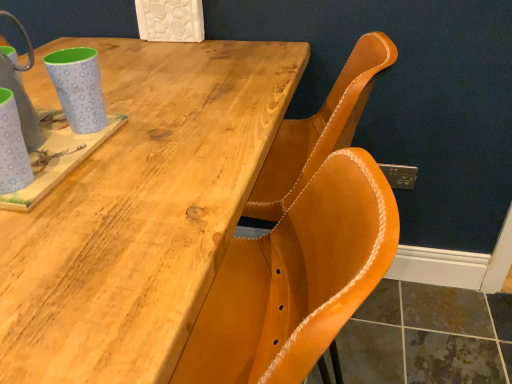
Question: Is light blue polka dot mug at upper left, placed as the first mug when sorted from back to front, positioned in front of matte blue cup at left, acting as the 1th mug starting from the front?

Choices:
 (A) yes
 (B) no

Answer: (B)

Question: Is light blue polka dot mug at upper left, placed as the first mug when sorted from back to front, aimed at matte blue cup at left, which is the 2th mug from back to front?

Choices:
 (A) yes
 (B) no

Answer: (A)

Question: Does light blue polka dot mug at upper left, placed as the first mug when sorted from back to front, have a lesser height compared to matte blue cup at left, which is the 2th mug from back to front?

Choices:
 (A) yes
 (B) no

Answer: (B)

Question: From a real-world perspective, is light blue polka dot mug at upper left, which ranks as the 2th mug in front-to-back order, positioned under matte blue cup at left, which is the 2th mug from back to front, based on gravity?

Choices:
 (A) no
 (B) yes

Answer: (A)

Question: Is light blue polka dot mug at upper left, which ranks as the 2th mug in front-to-back order, far from matte blue cup at left, acting as the 1th mug starting from the front?

Choices:
 (A) yes
 (B) no

Answer: (B)

Question: Considering the relative sizes of light blue polka dot mug at upper left, which ranks as the 2th mug in front-to-back order, and matte blue cup at left, acting as the 1th mug starting from the front, in the image provided, is light blue polka dot mug at upper left, which ranks as the 2th mug in front-to-back order, bigger than matte blue cup at left, acting as the 1th mug starting from the front,?

Choices:
 (A) yes
 (B) no

Answer: (A)

Question: From a real-world perspective, is matte blue cup at left, which is the 2th mug from back to front, on light blue polka dot mug at upper left, placed as the first mug when sorted from back to front?

Choices:
 (A) no
 (B) yes

Answer: (A)

Question: Is matte blue cup at left, which is the 2th mug from back to front, positioned beyond the bounds of light blue polka dot mug at upper left, placed as the first mug when sorted from back to front?

Choices:
 (A) no
 (B) yes

Answer: (B)

Question: Considering the relative positions of matte blue cup at left, acting as the 1th mug starting from the front, and light blue polka dot mug at upper left, which ranks as the 2th mug in front-to-back order, in the image provided, is matte blue cup at left, acting as the 1th mug starting from the front, behind light blue polka dot mug at upper left, which ranks as the 2th mug in front-to-back order,?

Choices:
 (A) no
 (B) yes

Answer: (A)

Question: Are matte blue cup at left, acting as the 1th mug starting from the front, and light blue polka dot mug at upper left, placed as the first mug when sorted from back to front, making contact?

Choices:
 (A) yes
 (B) no

Answer: (B)

Question: Is matte blue cup at left, acting as the 1th mug starting from the front, facing towards light blue polka dot mug at upper left, which ranks as the 2th mug in front-to-back order?

Choices:
 (A) no
 (B) yes

Answer: (A)

Question: Can light blue polka dot mug at upper left, placed as the first mug when sorted from back to front, be found inside matte blue cup at left, acting as the 1th mug starting from the front?

Choices:
 (A) yes
 (B) no

Answer: (B)

Question: From a real-world perspective, is natural wood table at upper left located beneath light blue polka dot mug at upper left, which ranks as the 2th mug in front-to-back order?

Choices:
 (A) no
 (B) yes

Answer: (B)